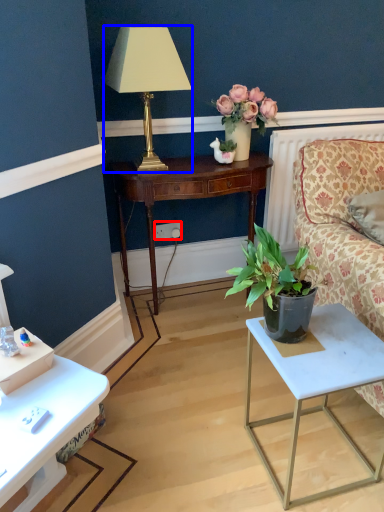
Question: Which object is closer to the camera taking this photo, power outlet (highlighted by a red box) or lamp (highlighted by a blue box)?

Choices:
 (A) power outlet
 (B) lamp

Answer: (B)